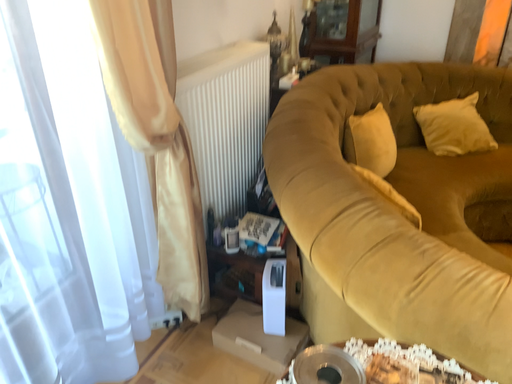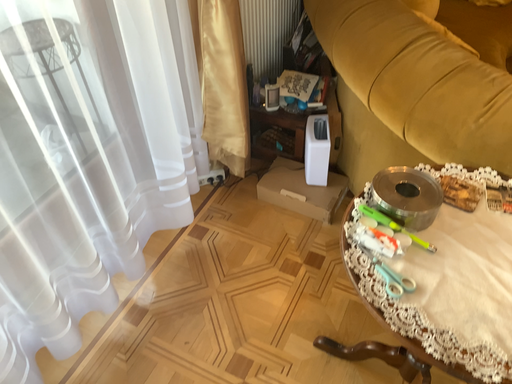
Question: How did the camera likely rotate when shooting the video?

Choices:
 (A) rotated upward
 (B) rotated downward

Answer: (B)